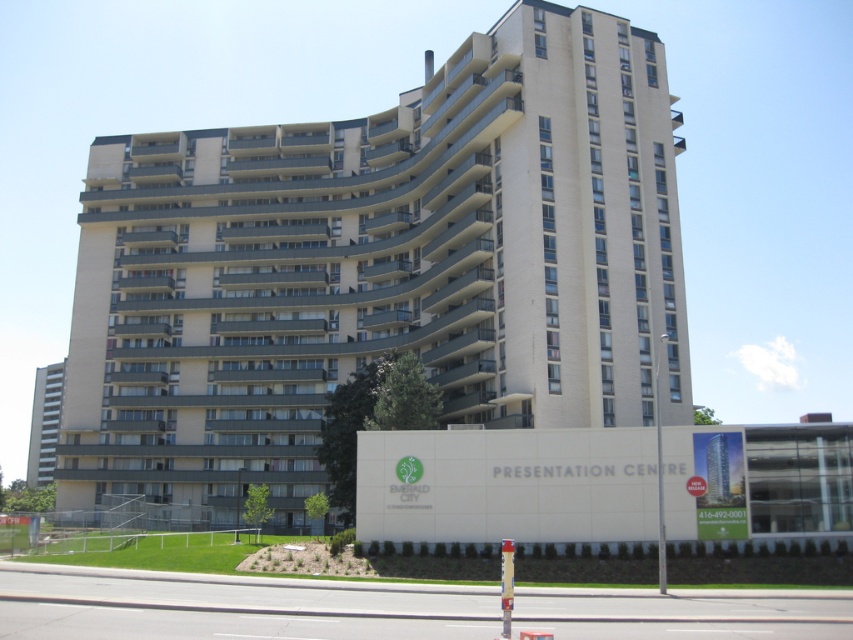
You are a visitor at the presentation centre and want to know which of the beige concrete building at center or beige concrete building at left is taller. Can you tell me?

The beige concrete building at center has a greater height compared to the beige concrete building at left, so the beige concrete building at center is taller.

You are a drone operator tasked with capturing aerial footage of the beige concrete building at center and the beige concrete building at left. The minimum distance required between the two buildings for your drone to safely navigate between them is 400 feet. Based on the information provided, can your drone safely navigate between them?

The beige concrete building at center is 459.09 feet from the beige concrete building at left. Since the required minimum distance is 400 feet, the drone can safely navigate between them as the distance exceeds the required threshold.

You are a real estate agent who needs to guide visitors to the presentation centre. You see the beige concrete building at center and the beige concrete building at left. Which one has a sign indicating the presentation centre?

The beige concrete building at center has the sign indicating the presentation centre.